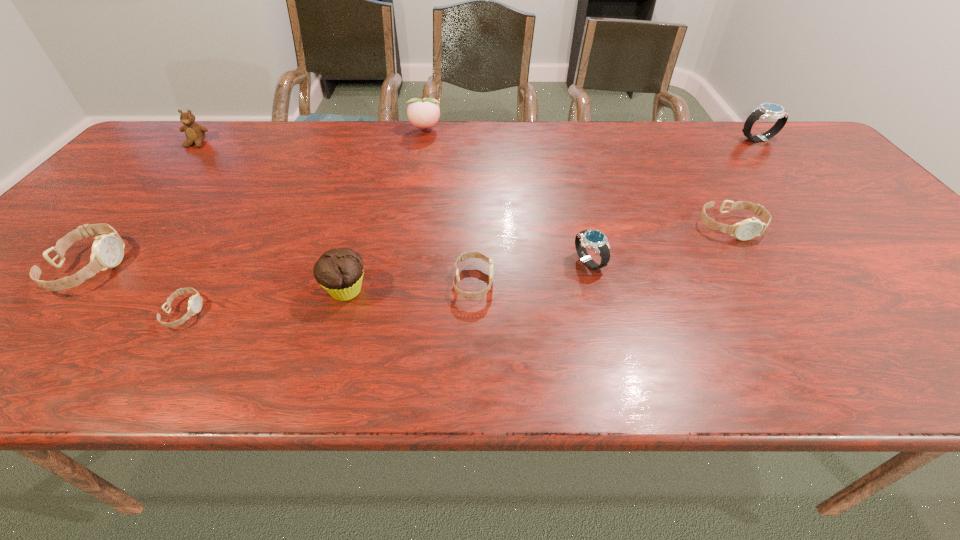
The image size is (960, 540). Identify the location of pink peach. (424, 113).

Locate an element on the screen. The image size is (960, 540). the fifth object from right to left is located at coordinates (424, 113).

Identify the location of the right silver watch. pos(766,110).

What are the coordinates of `the rightmost object` in the screenshot? It's located at (766, 110).

The width and height of the screenshot is (960, 540). Find the location of `teddy bear`. teddy bear is located at coordinates (195, 134).

In order to click on chocolate muffin in this screenshot , I will do `click(339, 271)`.

Where is `muffin`? This screenshot has height=540, width=960. muffin is located at coordinates (339, 271).

I want to click on the biggest beige watch, so click(107, 250).

Locate an element on the screen. The width and height of the screenshot is (960, 540). the leftmost beige watch is located at coordinates (107, 250).

This screenshot has width=960, height=540. Identify the location of the nearer silver watch. (593, 239).